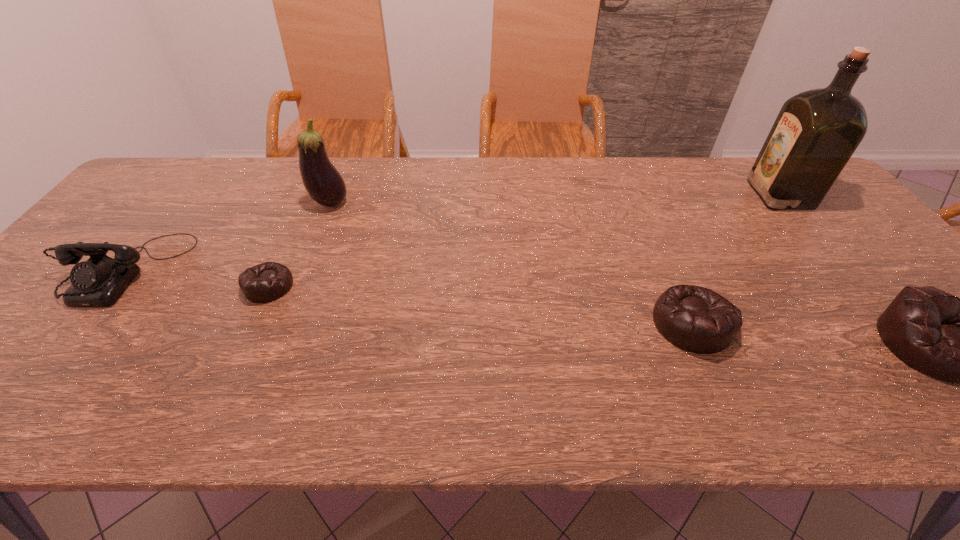
At what (x,y) coordinates should I click in order to perform the action: click on free space between the tallest object and the leftmost object. Please return your answer as a coordinate pair (x, y). Looking at the image, I should click on (452, 232).

Locate an element on the screen. This screenshot has width=960, height=540. vacant area between the leftmost beanbag and the liquor is located at coordinates (524, 240).

Locate which object is the third closest to the telephone. Please provide its 2D coordinates. Your answer should be formatted as a tuple, i.e. [(x, y)], where the tuple contains the x and y coordinates of a point satisfying the conditions above.

[(696, 319)]

Select which object is the fifth closest to the shortest beanbag. Please provide its 2D coordinates. Your answer should be formatted as a tuple, i.e. [(x, y)], where the tuple contains the x and y coordinates of a point satisfying the conditions above.

[(959, 340)]

Identify which beanbag is located as the second nearest to the second tallest object. Please provide its 2D coordinates. Your answer should be formatted as a tuple, i.e. [(x, y)], where the tuple contains the x and y coordinates of a point satisfying the conditions above.

[(696, 319)]

Locate which beanbag is the closest to the second shortest beanbag. Please provide its 2D coordinates. Your answer should be formatted as a tuple, i.e. [(x, y)], where the tuple contains the x and y coordinates of a point satisfying the conditions above.

[(959, 340)]

The image size is (960, 540). What are the coordinates of `free space that satisfies the following two spatial constraints: 1. on the label of the liquor; 2. on the front-facing side of the telephone` in the screenshot? It's located at (838, 268).

Locate an element on the screen. free space that satisfies the following two spatial constraints: 1. on the back side of the shortest beanbag; 2. on the right side of the eggplant is located at coordinates (306, 203).

Find the location of a particular element. Image resolution: width=960 pixels, height=540 pixels. blank space that satisfies the following two spatial constraints: 1. on the label of the tallest object; 2. on the front-facing side of the leftmost object is located at coordinates (838, 268).